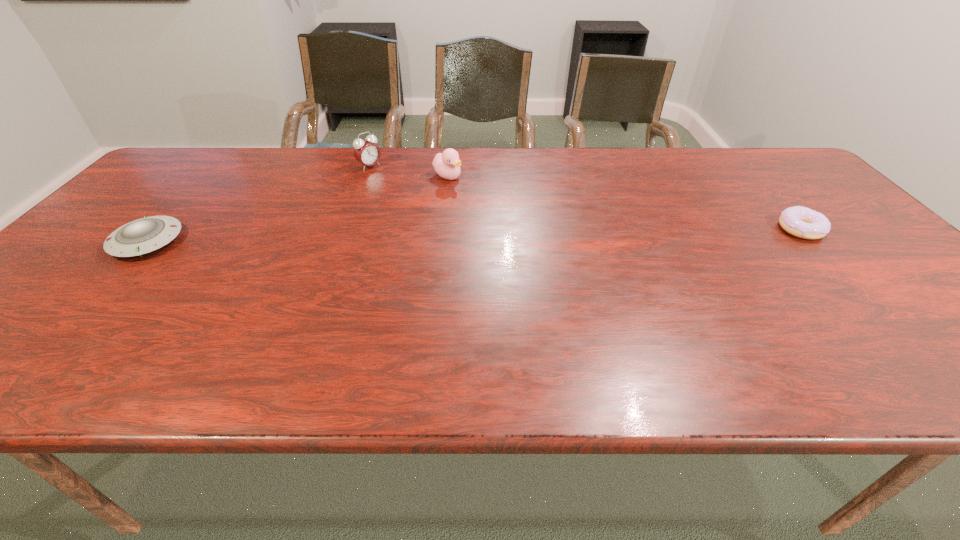
Find the location of a particular element. Image resolution: width=960 pixels, height=540 pixels. vacant space on the desktop that is between the leftmost object and the doughnut and is positioned on the front-facing side of the duckling is located at coordinates (562, 234).

The width and height of the screenshot is (960, 540). I want to click on vacant spot on the desktop that is between the saucer and the doughnut and is positioned on the clock face of the third object from right to left, so click(460, 235).